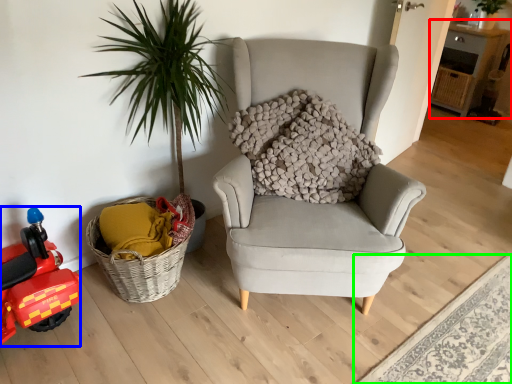
Question: Based on their relative distances, which object is nearer to table (highlighted by a red box)? Choose from toy car (highlighted by a blue box) and plain (highlighted by a green box).

Choices:
 (A) toy car
 (B) plain

Answer: (B)